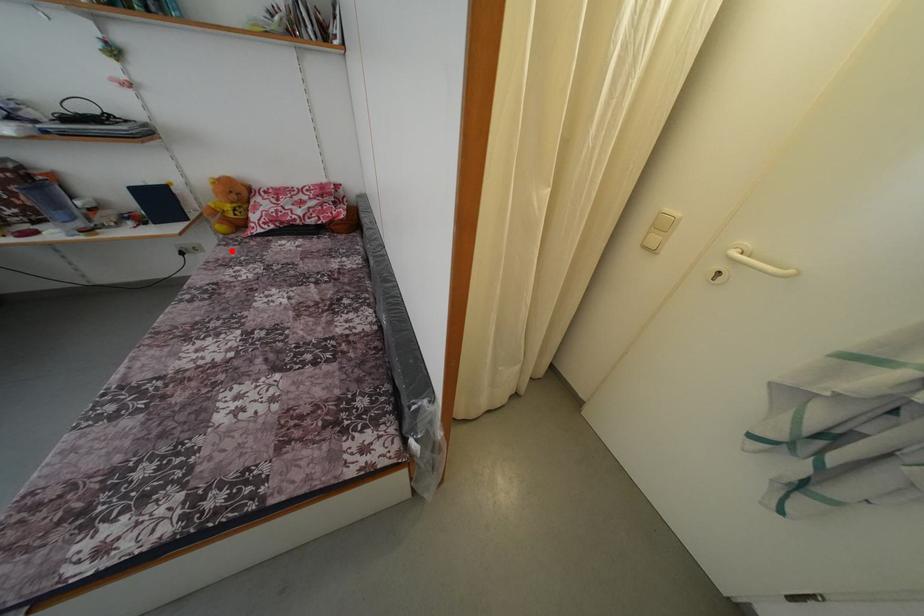
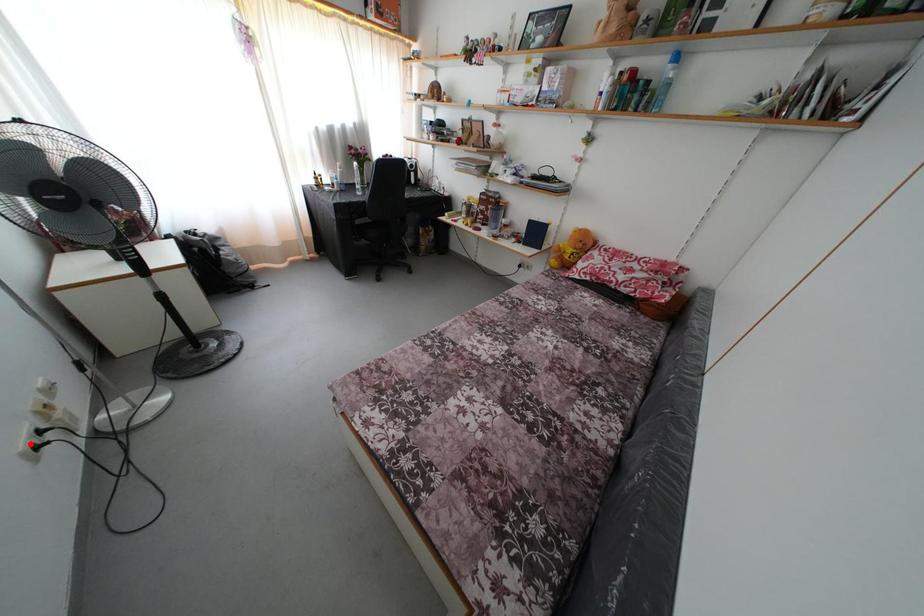
I am providing you with two images of the same scene from different viewpoints. A red point is marked on the first image and another point is marked on the second image. Is the marked point in image1 the same physical position as the marked point in image2?

No